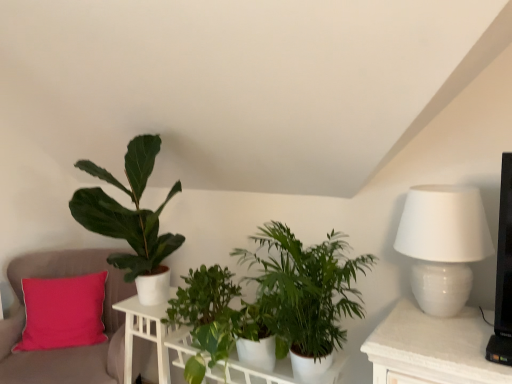
Question: Is white glossy table lamp at right not within white glossy table at center, which is the 2th table from left to right?

Choices:
 (A) yes
 (B) no

Answer: (A)

Question: Is white glossy table lamp at right smaller than white glossy table at center, which is the 2th table from left to right?

Choices:
 (A) no
 (B) yes

Answer: (B)

Question: Does white glossy table lamp at right have a greater width compared to white glossy table at center, which is the 2th table from left to right?

Choices:
 (A) yes
 (B) no

Answer: (B)

Question: Can you confirm if white glossy table lamp at right is bigger than white glossy table at center, acting as the 1th table starting from the right?

Choices:
 (A) yes
 (B) no

Answer: (B)

Question: Are white glossy table lamp at right and white glossy table at center, which is the 2th table from left to right, beside each other?

Choices:
 (A) no
 (B) yes

Answer: (A)

Question: Does white glossy table lamp at right turn towards white glossy table at center, acting as the 1th table starting from the right?

Choices:
 (A) yes
 (B) no

Answer: (B)

Question: Does green matte plant at center, which is the second houseplant from left to right, have a lesser width compared to pink fabric cushion at left?

Choices:
 (A) no
 (B) yes

Answer: (A)

Question: From the image's perspective, is green matte plant at center, which is the second houseplant from left to right, under pink fabric cushion at left?

Choices:
 (A) no
 (B) yes

Answer: (A)

Question: Is green matte plant at center, marked as the 2th houseplant in a right-to-left arrangement, touching pink fabric cushion at left?

Choices:
 (A) yes
 (B) no

Answer: (B)

Question: Is green matte plant at center, which is the second houseplant from left to right, far away from pink fabric cushion at left?

Choices:
 (A) yes
 (B) no

Answer: (B)

Question: Is green matte plant at center, which is the second houseplant from left to right, outside of pink fabric cushion at left?

Choices:
 (A) no
 (B) yes

Answer: (B)

Question: From a real-world perspective, is green matte plant at center, marked as the 2th houseplant in a right-to-left arrangement, physically below pink fabric cushion at left?

Choices:
 (A) no
 (B) yes

Answer: (A)

Question: Is the position of green matte plant at center, which is the second houseplant from left to right, more distant than that of white wood table at lower left, which is the 2th table from right to left?

Choices:
 (A) yes
 (B) no

Answer: (B)